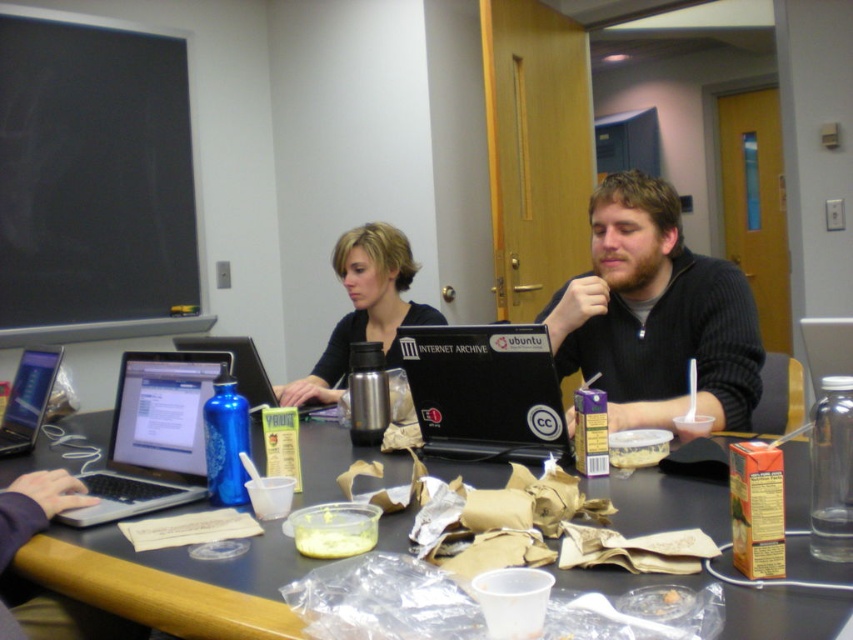
You are organizing a small event and need to choose between the blue glass bottle at center and the brushed metal thermos at center for serving drinks. Based on their sizes, which one would be more suitable for holding a larger quantity of liquid?

The brushed metal thermos at center is more suitable for holding a larger quantity of liquid since it has a bigger size compared to the blue glass bottle at center.

You are organizing the items on the table in the image. To place the blue glass bottle at center exactly at the center of the table, do you need to move it to the left or right?

The blue glass bottle at center is currently at point 0.692 on the x and y axis. Since the center of the table would be at 0.5, the bottle needs to be moved to the left to reach the center.